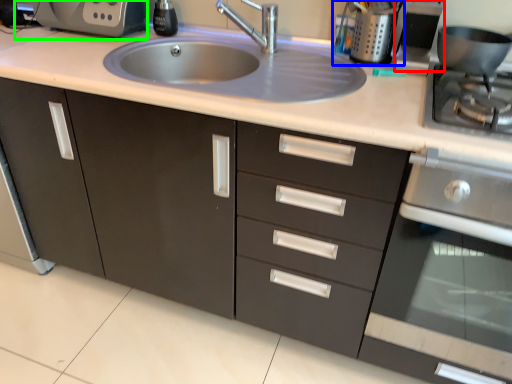
Question: Which is farther away from appliance (highlighted by a red box)? appliance (highlighted by a blue box) or coffee machine (highlighted by a green box)?

Choices:
 (A) appliance
 (B) coffee machine

Answer: (B)